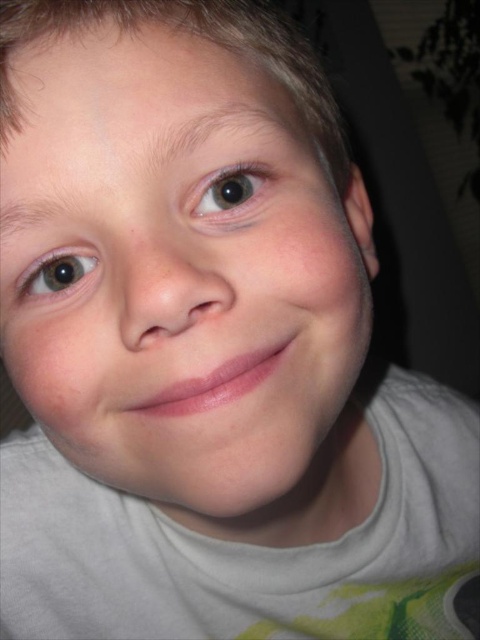
Question: Is brown glossy eye at upper left to the left of brown matte eye at left from the viewer's perspective?

Choices:
 (A) yes
 (B) no

Answer: (B)

Question: Is smooth skin face at center positioned in front of brown matte eye at left?

Choices:
 (A) no
 (B) yes

Answer: (B)

Question: Which object is the closest to the brown glossy eye at upper left?

Choices:
 (A) brown matte eye at left
 (B) smooth skin face at center

Answer: (A)

Question: Among these points, which one is nearest to the camera?

Choices:
 (A) (186, 368)
 (B) (35, 266)

Answer: (A)

Question: Is the position of brown glossy eye at upper left less distant than that of brown matte eye at left?

Choices:
 (A) yes
 (B) no

Answer: (A)

Question: Which point is farther to the camera?

Choices:
 (A) (253, 176)
 (B) (108, 356)

Answer: (A)